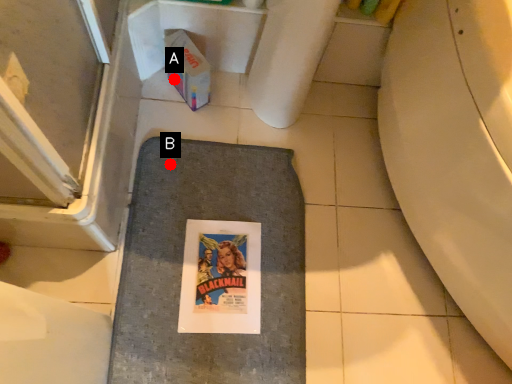
Question: Two points are circled on the image, labeled by A and B beside each circle. Which point is farther to the camera?

Choices:
 (A) A is further
 (B) B is further

Answer: (A)